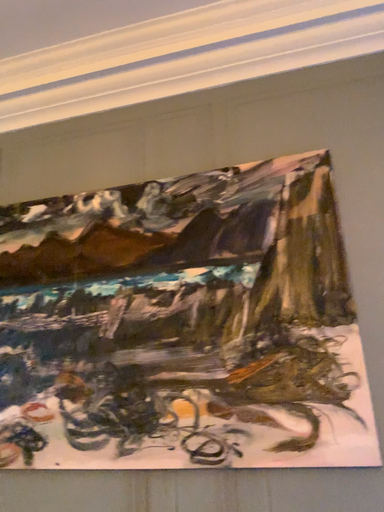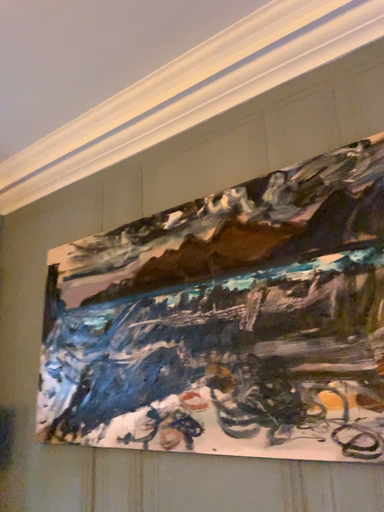
Question: How did the camera likely rotate when shooting the video?

Choices:
 (A) rotated right
 (B) rotated left

Answer: (B)